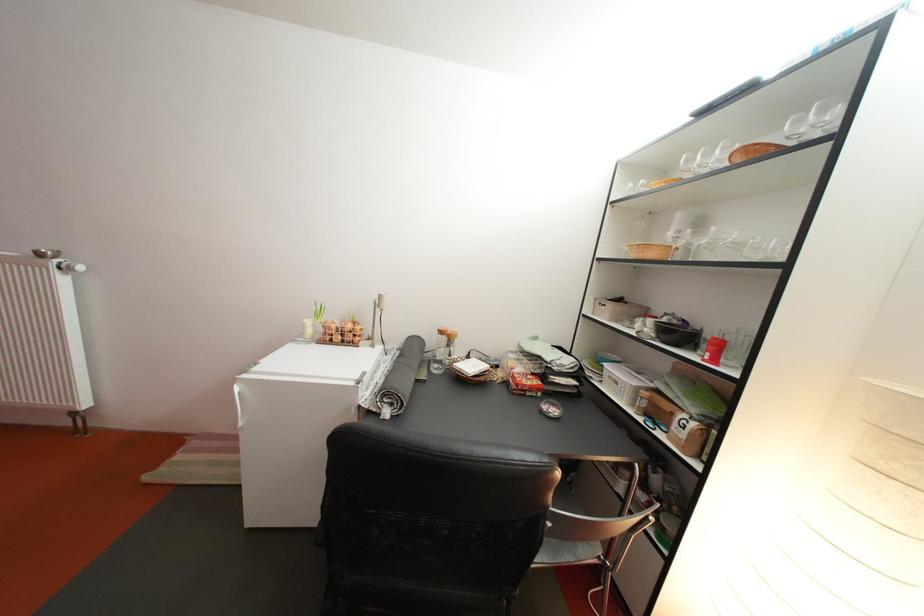
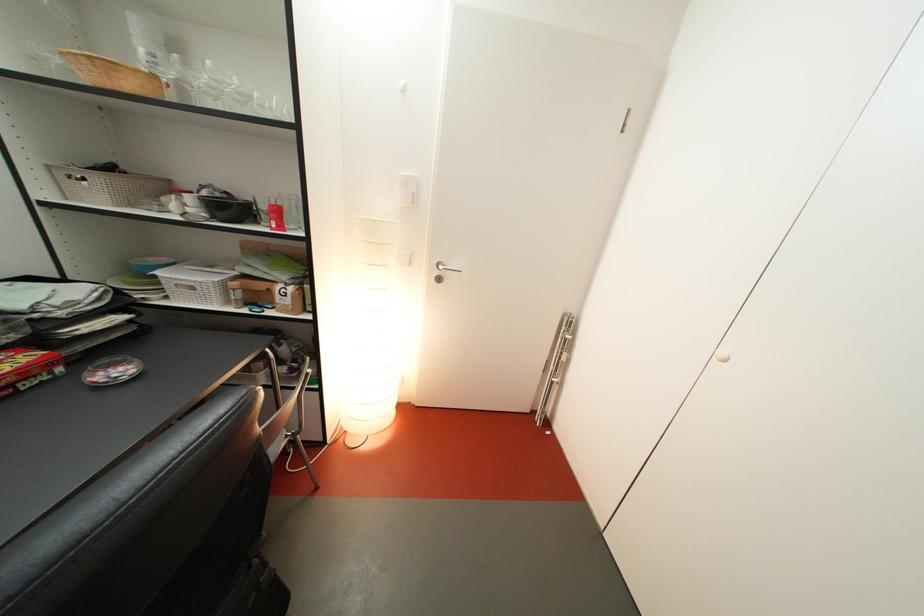
The point at (675, 326) is marked in the first image. Where is the corresponding point in the second image?

(216, 200)